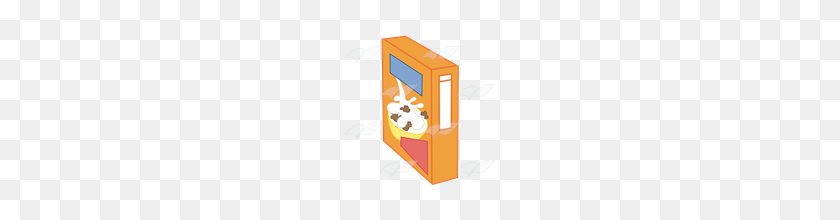
This screenshot has height=220, width=840. I want to click on yellow bowl, so click(x=401, y=127).